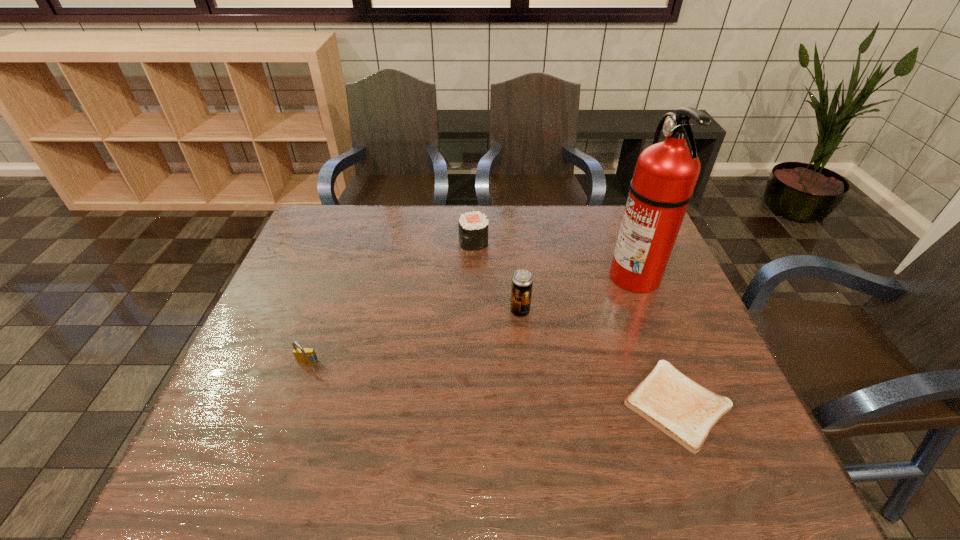
At what (x,y) coordinates should I click in order to perform the action: click on empty space between the tallest object and the padlock. Please return your answer as a coordinate pair (x, y). Looking at the image, I should click on (471, 320).

Locate an element on the screen. The width and height of the screenshot is (960, 540). free spot between the fourth shortest object and the sushi is located at coordinates (496, 276).

Image resolution: width=960 pixels, height=540 pixels. In order to click on blank region between the shortest object and the leftmost object in this screenshot , I will do `click(492, 384)`.

The image size is (960, 540). What are the coordinates of `vacant space that's between the sushi and the padlock` in the screenshot? It's located at (391, 302).

I want to click on object that ranks as the closest to the second object from left to right, so click(522, 281).

Identify the location of the second closest object to the sushi. Image resolution: width=960 pixels, height=540 pixels. (666, 173).

Where is `free space that satisfies the following two spatial constraints: 1. at the nozzle of the tallest object; 2. on the side with the combination dials of the padlock`? This screenshot has width=960, height=540. free space that satisfies the following two spatial constraints: 1. at the nozzle of the tallest object; 2. on the side with the combination dials of the padlock is located at coordinates (669, 363).

The width and height of the screenshot is (960, 540). In order to click on free space that satisfies the following two spatial constraints: 1. at the nozzle of the tallest object; 2. on the side with the combination dials of the leftmost object in this screenshot , I will do `click(669, 363)`.

Locate an element on the screen. This screenshot has width=960, height=540. vacant space that satisfies the following two spatial constraints: 1. on the front side of the second tallest object; 2. on the left side of the sushi is located at coordinates (472, 311).

Image resolution: width=960 pixels, height=540 pixels. I want to click on free location that satisfies the following two spatial constraints: 1. at the nozzle of the fire extinguisher; 2. on the side with the combination dials of the leftmost object, so click(x=669, y=363).